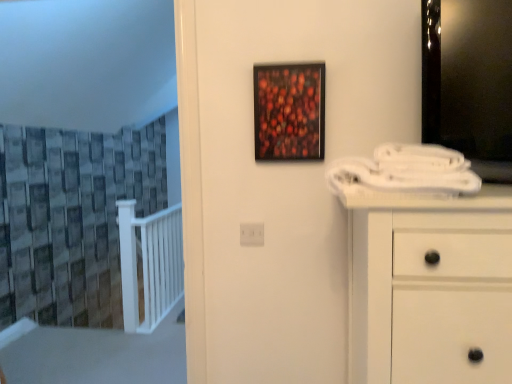
Question: Is white plastic electric outlet at center positioned behind textured gray curtain at left?

Choices:
 (A) no
 (B) yes

Answer: (B)

Question: From a real-world perspective, is white plastic electric outlet at center positioned under textured gray curtain at left based on gravity?

Choices:
 (A) yes
 (B) no

Answer: (A)

Question: Are white plastic electric outlet at center and textured gray curtain at left located far from each other?

Choices:
 (A) no
 (B) yes

Answer: (B)

Question: Considering the relative sizes of white plastic electric outlet at center and textured gray curtain at left in the image provided, is white plastic electric outlet at center taller than textured gray curtain at left?

Choices:
 (A) no
 (B) yes

Answer: (A)

Question: Considering the relative sizes of white plastic electric outlet at center and textured gray curtain at left in the image provided, is white plastic electric outlet at center thinner than textured gray curtain at left?

Choices:
 (A) no
 (B) yes

Answer: (B)

Question: Is the surface of white plastic electric outlet at center in direct contact with textured gray curtain at left?

Choices:
 (A) no
 (B) yes

Answer: (A)

Question: Considering the relative sizes of textured gray curtain at left and wooden-framed artwork at center in the image provided, is textured gray curtain at left taller than wooden-framed artwork at center?

Choices:
 (A) yes
 (B) no

Answer: (A)

Question: From a real-world perspective, does textured gray curtain at left sit lower than wooden-framed artwork at center?

Choices:
 (A) yes
 (B) no

Answer: (A)

Question: Considering the relative positions of textured gray curtain at left and wooden-framed artwork at center in the image provided, is textured gray curtain at left to the left of wooden-framed artwork at center from the viewer's perspective?

Choices:
 (A) no
 (B) yes

Answer: (B)

Question: Would you say textured gray curtain at left is a long distance from wooden-framed artwork at center?

Choices:
 (A) yes
 (B) no

Answer: (A)

Question: From the image's perspective, does textured gray curtain at left appear lower than wooden-framed artwork at center?

Choices:
 (A) yes
 (B) no

Answer: (A)

Question: Is textured gray curtain at left smaller than wooden-framed artwork at center?

Choices:
 (A) no
 (B) yes

Answer: (A)

Question: Considering the relative sizes of wooden-framed artwork at center and white plastic electric outlet at center in the image provided, is wooden-framed artwork at center smaller than white plastic electric outlet at center?

Choices:
 (A) no
 (B) yes

Answer: (A)